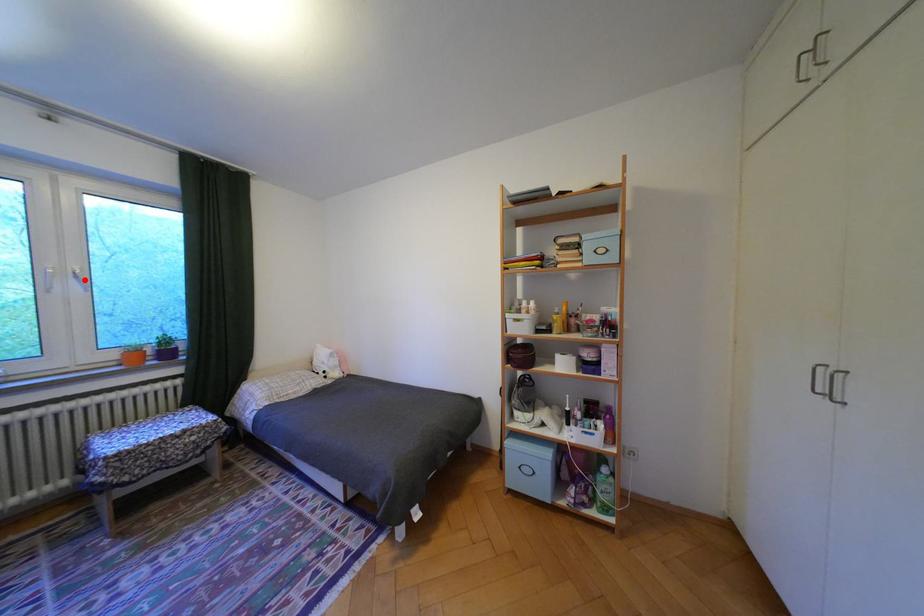
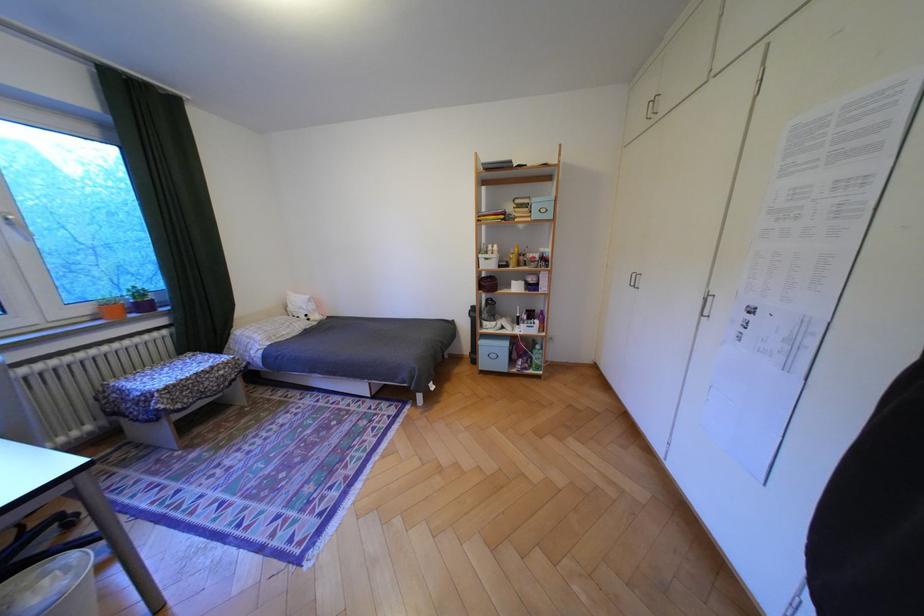
Locate, in the second image, the point that corresponds to the highlighted location in the first image.

(18, 227)